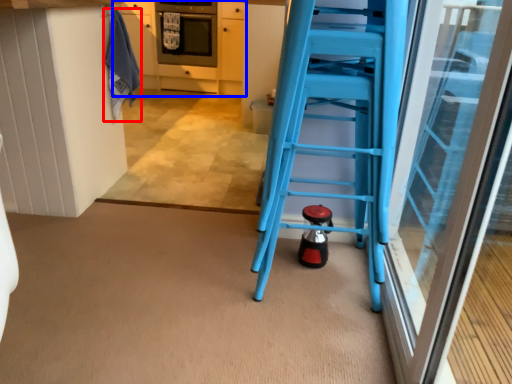
Question: Which point is further to the camera, laundry (highlighted by a red box) or cabinetry (highlighted by a blue box)?

Choices:
 (A) laundry
 (B) cabinetry

Answer: (B)